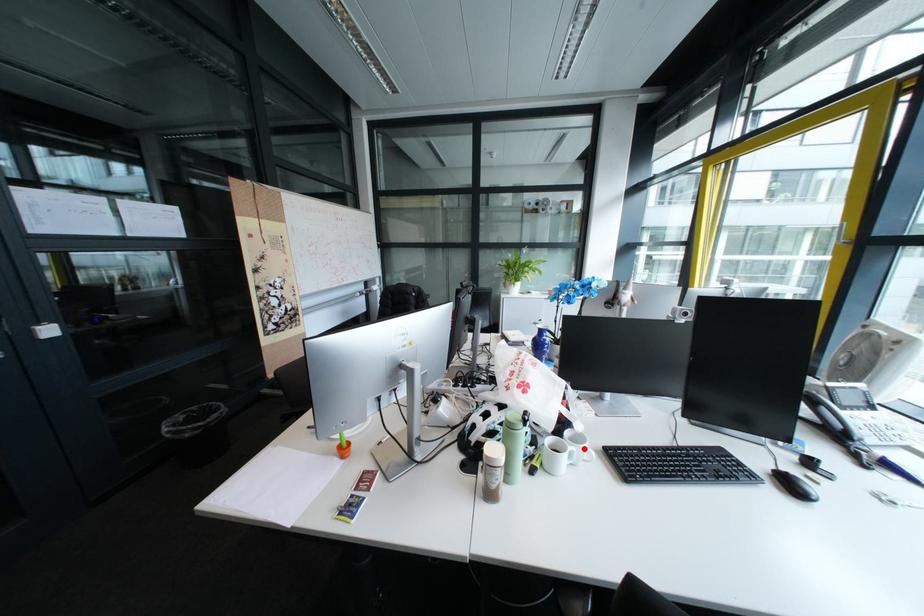
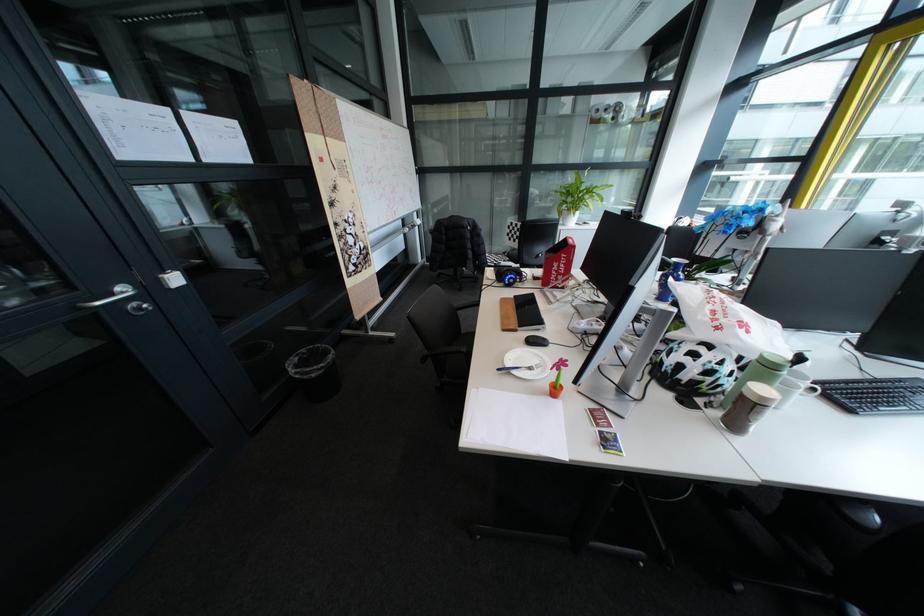
In the second image, find the point that corresponds to the highlighted location in the first image.

(815, 386)